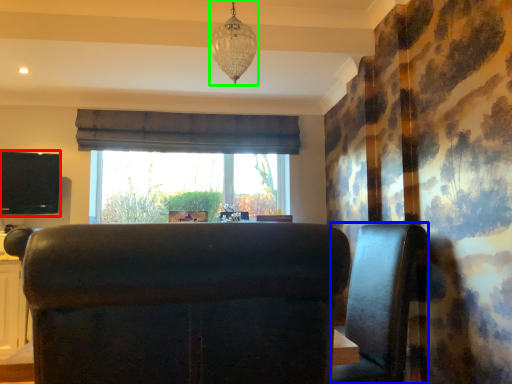
Question: Estimate the real-world distances between objects in this image. Which object is farther from wide (highlighted by a red box), furniture (highlighted by a blue box) or lamp (highlighted by a green box)?

Choices:
 (A) furniture
 (B) lamp

Answer: (A)